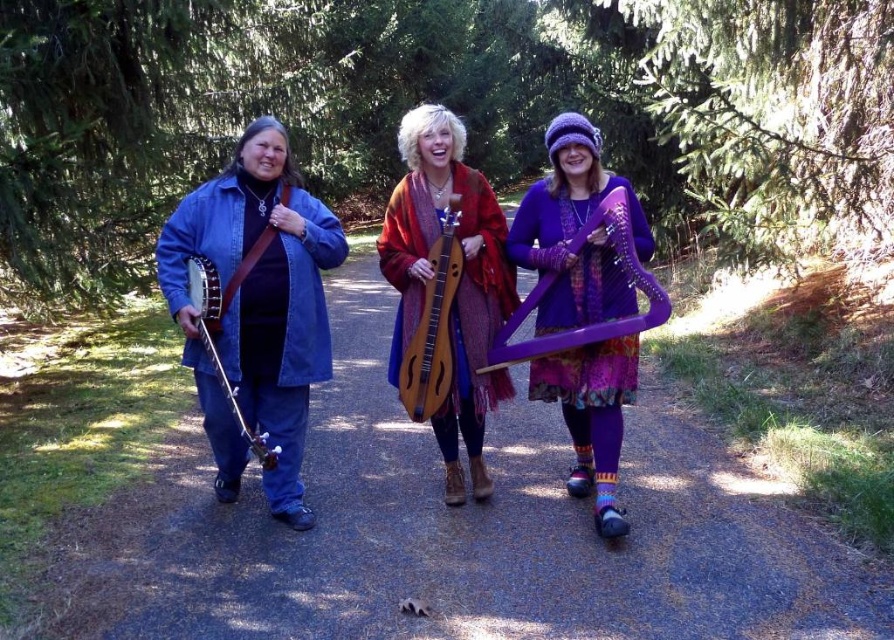
Question: Can you confirm if purple knitted hat at upper center is bigger than purple wood harp at center?

Choices:
 (A) no
 (B) yes

Answer: (B)

Question: Does purple knitted hat at upper center have a larger size compared to matte brown banjo at left?

Choices:
 (A) no
 (B) yes

Answer: (B)

Question: Which object is the closest to the wooden dulcimer at center?

Choices:
 (A) wooden acoustic guitar at center
 (B) denim jacket at left
 (C) matte brown banjo at left
 (D) gravel path at center

Answer: (A)

Question: Which point is closer to the camera?

Choices:
 (A) (663, 312)
 (B) (583, 195)

Answer: (A)

Question: Which point is farther to the camera?

Choices:
 (A) purple knitted hat at upper center
 (B) denim jacket at left
 (C) purple wood harp at center
 (D) gravel path at center

Answer: (B)

Question: Can you confirm if denim jacket at left is positioned above matte brown banjo at left?

Choices:
 (A) no
 (B) yes

Answer: (B)